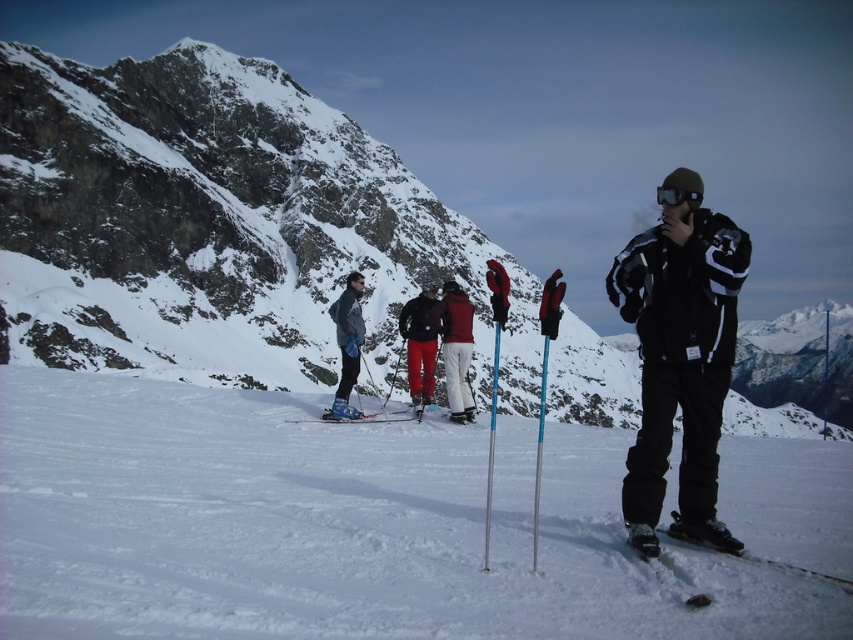
Who is positioned more to the right, black matte jacket at right or black matte goggles at center?

Positioned to the right is black matte goggles at center.

The width and height of the screenshot is (853, 640). What do you see at coordinates (680, 364) in the screenshot? I see `black matte jacket at right` at bounding box center [680, 364].

Locate an element on the screen. The image size is (853, 640). black matte jacket at right is located at coordinates (680, 364).

Is white powder snow at center taller than black matte ski at lower right?

Correct, white powder snow at center is much taller as black matte ski at lower right.

Between point (387, 636) and point (647, 548), which one is positioned behind?

Positioned behind is point (647, 548).

Who is more forward, (x=593, y=548) or (x=680, y=531)?

Point (x=593, y=548) is in front.

Identify the location of white powder snow at center. This screenshot has width=853, height=640. (335, 525).

Is point (16, 484) positioned behind point (451, 323)?

No, it is in front of (451, 323).

Consider the image. Is white powder snow at center bigger than red fabric jacket at center?

Indeed, white powder snow at center has a larger size compared to red fabric jacket at center.

Who is more forward, (x=244, y=499) or (x=460, y=397)?

Point (x=244, y=499) is more forward.

You are a GUI agent. You are given a task and a screenshot of the screen. Output one action in this format:
    pyautogui.click(x=<x>, y=<y>)
    Task: Click on the white powder snow at center
    Image resolution: width=853 pixels, height=640 pixels.
    Given the screenshot: What is the action you would take?
    pyautogui.click(x=335, y=525)